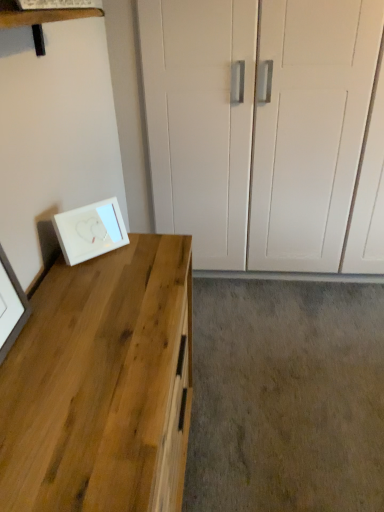
Describe the element at coordinates (102, 385) in the screenshot. I see `natural wood desk at left` at that location.

What are the coordinates of `natural wood desk at left` in the screenshot? It's located at (102, 385).

Describe the element at coordinates (90, 231) in the screenshot. I see `white glossy picture frame at lower left` at that location.

The width and height of the screenshot is (384, 512). I want to click on white glossy picture frame at lower left, so click(90, 231).

Where is `natural wood desk at left`? The image size is (384, 512). natural wood desk at left is located at coordinates (102, 385).

Looking at this image, between white glossy picture frame at lower left and natural wood desk at left, which one appears on the left side from the viewer's perspective?

Positioned to the left is white glossy picture frame at lower left.

Considering the positions of objects white glossy picture frame at lower left and natural wood desk at left in the image provided, who is behind, white glossy picture frame at lower left or natural wood desk at left?

white glossy picture frame at lower left is more distant.

Considering the positions of points (79, 224) and (124, 475), is point (79, 224) farther from camera compared to point (124, 475)?

That is True.

From the image's perspective, would you say white glossy picture frame at lower left is positioned over natural wood desk at left?

Yes, from the image's perspective, white glossy picture frame at lower left is over natural wood desk at left.

From a real-world perspective, relative to natural wood desk at left, is white glossy picture frame at lower left vertically above or below?

white glossy picture frame at lower left is above natural wood desk at left.

Which of these two, white glossy picture frame at lower left or natural wood desk at left, is wider?

With larger width is natural wood desk at left.

Considering the sizes of objects white glossy picture frame at lower left and natural wood desk at left in the image provided, who is shorter, white glossy picture frame at lower left or natural wood desk at left?

Standing shorter between the two is white glossy picture frame at lower left.

Which of these two, white glossy picture frame at lower left or natural wood desk at left, is smaller?

white glossy picture frame at lower left is smaller.

Would you say white glossy picture frame at lower left contains natural wood desk at left?

No, natural wood desk at left is not a part of white glossy picture frame at lower left.

Is there a large distance between white glossy picture frame at lower left and natural wood desk at left?

No, white glossy picture frame at lower left is not far from natural wood desk at left.

Is natural wood desk at left at the back of white glossy picture frame at lower left?

white glossy picture frame at lower left does not have its back to natural wood desk at left.

Find the location of a particular element. desk below the white glossy picture frame at lower left (from the image's perspective) is located at coordinates (102, 385).

Is natural wood desk at left to the left of white glossy picture frame at lower left from the viewer's perspective?

No.

Which object is more forward, natural wood desk at left or white glossy picture frame at lower left?

natural wood desk at left.

Is point (185, 324) closer or farther from the camera than point (75, 248)?

Point (185, 324).

From the image's perspective, is natural wood desk at left above or below white glossy picture frame at lower left?

Based on their image positions, natural wood desk at left is located beneath white glossy picture frame at lower left.

From a real-world perspective, which object stands above the other?

From a 3D spatial view, white glossy picture frame at lower left is above.

Which of these two, natural wood desk at left or white glossy picture frame at lower left, is wider?

natural wood desk at left is wider.

In terms of height, does natural wood desk at left look taller or shorter compared to white glossy picture frame at lower left?

natural wood desk at left is taller than white glossy picture frame at lower left.

Considering the relative sizes of natural wood desk at left and white glossy picture frame at lower left in the image provided, is natural wood desk at left bigger than white glossy picture frame at lower left?

Indeed, natural wood desk at left has a larger size compared to white glossy picture frame at lower left.

Is natural wood desk at left inside the boundaries of white glossy picture frame at lower left, or outside?

natural wood desk at left is spatially situated outside white glossy picture frame at lower left.

Is natural wood desk at left with white glossy picture frame at lower left?

They are not placed beside each other.

Is natural wood desk at left facing towards white glossy picture frame at lower left?

No, natural wood desk at left does not turn towards white glossy picture frame at lower left.

What's the angular difference between natural wood desk at left and white glossy picture frame at lower left's facing directions?

natural wood desk at left and white glossy picture frame at lower left are facing 44.2 degrees away from each other.

The height and width of the screenshot is (512, 384). Find the location of `picture frame that appears above the natural wood desk at left (from the image's perspective)`. picture frame that appears above the natural wood desk at left (from the image's perspective) is located at coordinates (90, 231).

You are a GUI agent. You are given a task and a screenshot of the screen. Output one action in this format:
    pyautogui.click(x=<x>, y=<y>)
    Task: Click on the picture frame behind the natural wood desk at left
    
    Given the screenshot: What is the action you would take?
    pyautogui.click(x=90, y=231)

Find the location of `desk below the white glossy picture frame at lower left (from the image's perspective)`. desk below the white glossy picture frame at lower left (from the image's perspective) is located at coordinates (102, 385).